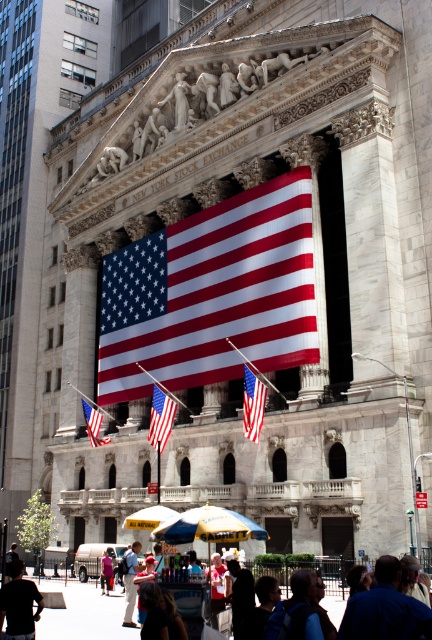
Based on the photo, can you confirm if dark blue backpack at lower center is shorter than denim jacket at lower center?

No.

Which is behind, point (301, 634) or point (105, 560)?

Positioned behind is point (105, 560).

Locate an element on the screen. dark blue backpack at lower center is located at coordinates (295, 611).

Is red-white-and-blue fabric at center below red-white-and-blue fabric flag at center?

Actually, red-white-and-blue fabric at center is above red-white-and-blue fabric flag at center.

Can you confirm if red-white-and-blue fabric at center is thinner than red-white-and-blue fabric flag at center?

In fact, red-white-and-blue fabric at center might be wider than red-white-and-blue fabric flag at center.

Which is behind, point (256, 412) or point (152, 413)?

The point (152, 413) is behind.

The height and width of the screenshot is (640, 432). Find the location of `red-white-and-blue fabric at center`. red-white-and-blue fabric at center is located at coordinates (253, 404).

What do you see at coordinates (19, 604) in the screenshot?
I see `dark blue jeans at lower left` at bounding box center [19, 604].

Does point (26, 611) come behind point (111, 564)?

No, it is in front of (111, 564).

Between point (12, 572) and point (108, 557), which one is positioned in front?

Point (12, 572) is more forward.

In order to click on dark blue jeans at lower left in this screenshot , I will do 19,604.